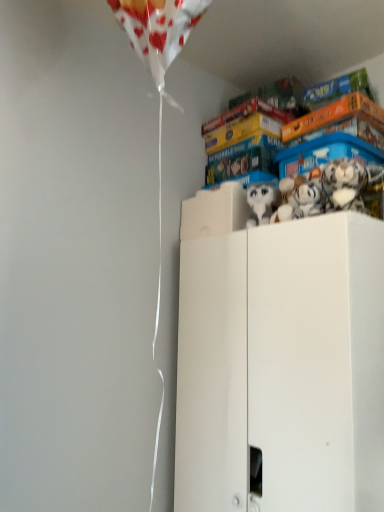
Question: Can you confirm if white plush toy at upper right, which is the third toy from left to right, is smaller than white matte cabinet at upper right?

Choices:
 (A) no
 (B) yes

Answer: (B)

Question: Is white plush toy at upper right, the 1th toy when ordered from right to left, closer to the viewer compared to white matte cabinet at upper right?

Choices:
 (A) yes
 (B) no

Answer: (B)

Question: Is white plush toy at upper right, which is the third toy from left to right, beside white matte cabinet at upper right?

Choices:
 (A) no
 (B) yes

Answer: (A)

Question: Does white plush toy at upper right, which is the third toy from left to right, lie behind white matte cabinet at upper right?

Choices:
 (A) no
 (B) yes

Answer: (B)

Question: From a real-world perspective, is white plush toy at upper right, the 1th toy when ordered from right to left, located higher than white matte cabinet at upper right?

Choices:
 (A) yes
 (B) no

Answer: (A)

Question: From a real-world perspective, relative to white plush toy at upper right, which is the third toy from left to right, is white plush toy at upper center, which appears as the first toy when viewed from the left, vertically above or below?

Choices:
 (A) below
 (B) above

Answer: (A)

Question: Relative to white plush toy at upper right, which is the third toy from left to right, is white plush toy at upper center, which is the third toy from right to left, in front or behind?

Choices:
 (A) front
 (B) behind

Answer: (B)

Question: Would you say white plush toy at upper center, which appears as the first toy when viewed from the left, is to the left or to the right of white plush toy at upper right, the 1th toy when ordered from right to left, in the picture?

Choices:
 (A) left
 (B) right

Answer: (A)

Question: Does point (249, 197) appear closer or farther from the camera than point (347, 197)?

Choices:
 (A) closer
 (B) farther

Answer: (B)

Question: Is white plush toy at upper right, which is the third toy from left to right, wider or thinner than white plush toy at upper center, which appears as the first toy when viewed from the left?

Choices:
 (A) thin
 (B) wide

Answer: (B)

Question: From a real-world perspective, is white plush toy at upper right, the 1th toy when ordered from right to left, positioned above or below white plush toy at upper center, which is the third toy from right to left?

Choices:
 (A) below
 (B) above

Answer: (B)

Question: Based on their positions, is white plush toy at upper right, which is the third toy from left to right, located to the left or right of white plush toy at upper center, which is the third toy from right to left?

Choices:
 (A) left
 (B) right

Answer: (B)

Question: Is white plush toy at upper right, which is the third toy from left to right, spatially inside white plush toy at upper center, which is the third toy from right to left, or outside of it?

Choices:
 (A) inside
 (B) outside

Answer: (B)

Question: From the image's perspective, is white plush toy at upper right, the second toy from the right, above or below white plush toy at upper center, which is the third toy from right to left?

Choices:
 (A) above
 (B) below

Answer: (B)

Question: Is white plush toy at upper right, the second toy from the right, in front of or behind white plush toy at upper center, which appears as the first toy when viewed from the left, in the image?

Choices:
 (A) behind
 (B) front

Answer: (B)